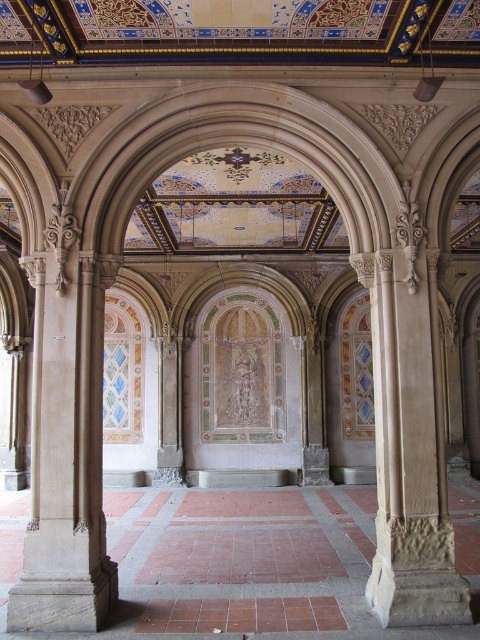
You are standing in the center of the room and see the point marked at coordinates (x=66, y=444). What object is located at that point?

The point at coordinates (x=66, y=444) corresponds to the smooth stone column at left.